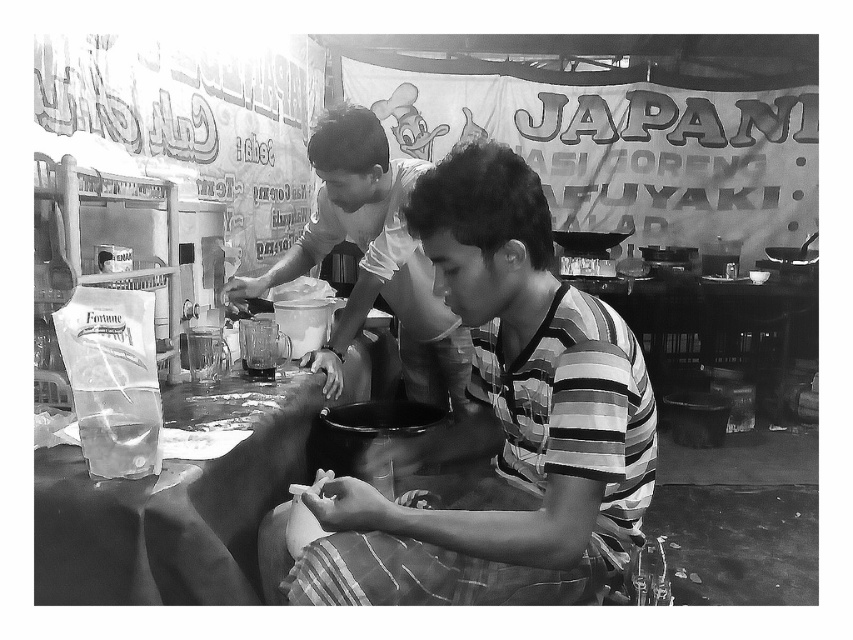
Question: Among these objects, which one is farthest from the camera?

Choices:
 (A) smooth white shirt at center
 (B) striped fabric shirt at center

Answer: (A)

Question: Is striped fabric shirt at center bigger than smooth white shirt at center?

Choices:
 (A) yes
 (B) no

Answer: (B)

Question: From the image, what is the correct spatial relationship of striped fabric shirt at center in relation to smooth white shirt at center?

Choices:
 (A) below
 (B) above

Answer: (A)

Question: From the image, what is the correct spatial relationship of striped fabric shirt at center in relation to smooth white shirt at center?

Choices:
 (A) right
 (B) left

Answer: (A)